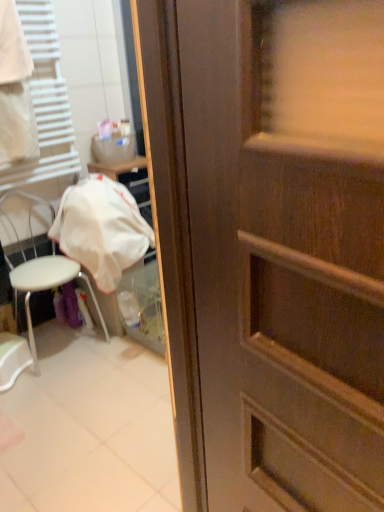
Question: Could you tell me if white plastic chair at left is facing white fabric at left?

Choices:
 (A) yes
 (B) no

Answer: (B)

Question: Is white plastic chair at left closer to camera compared to white fabric at left?

Choices:
 (A) yes
 (B) no

Answer: (B)

Question: From the image's perspective, would you say white plastic chair at left is positioned over white fabric at left?

Choices:
 (A) yes
 (B) no

Answer: (B)

Question: Is white plastic chair at left at the left side of white fabric at left?

Choices:
 (A) no
 (B) yes

Answer: (A)

Question: Can you confirm if white plastic chair at left is smaller than white fabric at left?

Choices:
 (A) no
 (B) yes

Answer: (A)

Question: Does white plastic chair at left have a greater height compared to white fabric at left?

Choices:
 (A) yes
 (B) no

Answer: (B)

Question: Could white fabric at left be considered to be inside white fabric at left?

Choices:
 (A) yes
 (B) no

Answer: (B)

Question: Does white fabric at left lie behind white fabric at left?

Choices:
 (A) yes
 (B) no

Answer: (A)

Question: Is white fabric at left at the back of white fabric at left?

Choices:
 (A) yes
 (B) no

Answer: (B)

Question: Is white fabric at left positioned before white fabric at left?

Choices:
 (A) no
 (B) yes

Answer: (A)

Question: From the image's perspective, would you say white fabric at left is shown under white fabric at left?

Choices:
 (A) yes
 (B) no

Answer: (A)

Question: Would you say white fabric at left is outside white fabric at left?

Choices:
 (A) no
 (B) yes

Answer: (B)

Question: Is white fabric at left turned away from white plastic chair at left?

Choices:
 (A) yes
 (B) no

Answer: (B)